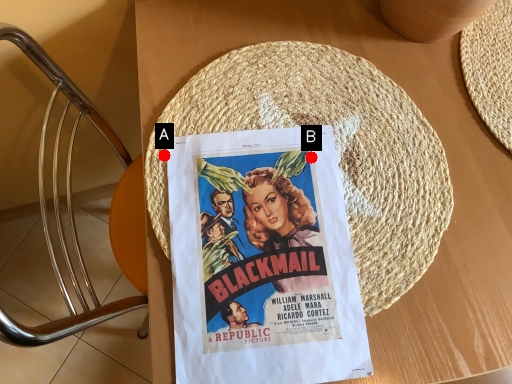
Question: Two points are circled on the image, labeled by A and B beside each circle. Which point appears closest to the camera in this image?

Choices:
 (A) A is closer
 (B) B is closer

Answer: (A)